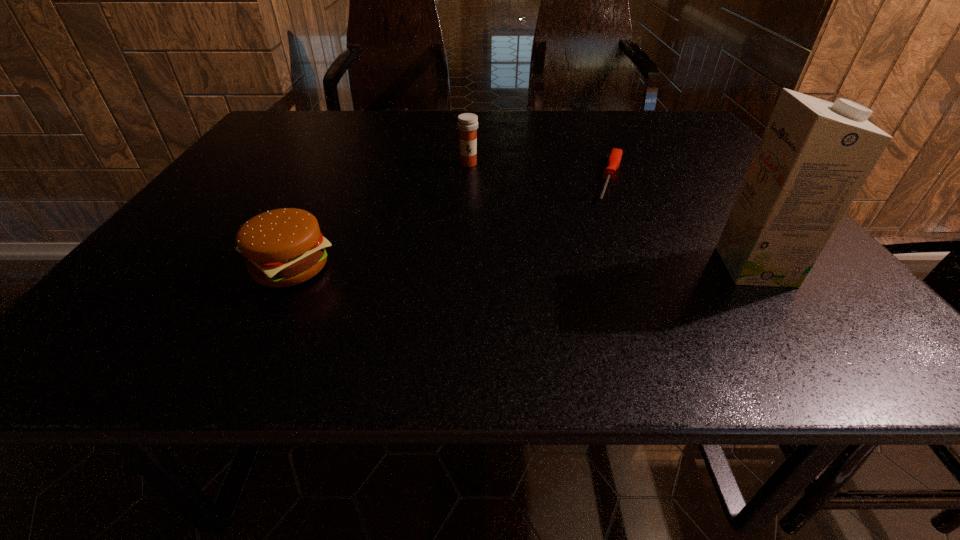
Where is `vacant region that satisfies the following two spatial constraints: 1. on the back side of the rightmost object; 2. on the left side of the hamburger`? The width and height of the screenshot is (960, 540). vacant region that satisfies the following two spatial constraints: 1. on the back side of the rightmost object; 2. on the left side of the hamburger is located at coordinates (291, 267).

In order to click on vacant space that satisfies the following two spatial constraints: 1. on the front side of the carton; 2. on the right side of the screwdriver in this screenshot , I will do `click(650, 267)`.